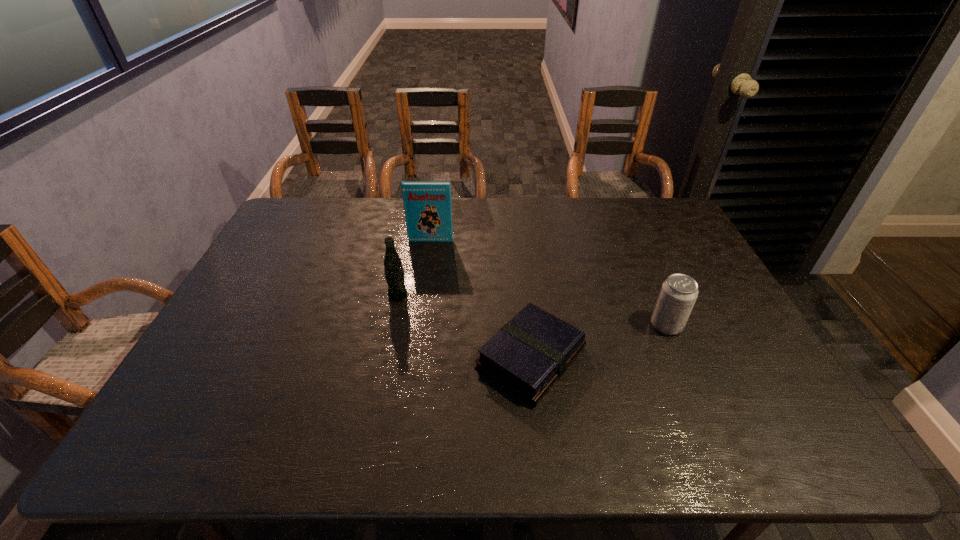
This screenshot has width=960, height=540. Identify the location of the taller book. (427, 204).

Locate an element on the screen. the farthest object is located at coordinates (427, 204).

This screenshot has width=960, height=540. Identify the location of beer bottle. (393, 270).

Locate an element on the screen. The width and height of the screenshot is (960, 540). soda can is located at coordinates (678, 294).

The height and width of the screenshot is (540, 960). Identify the location of the third tallest object. (678, 294).

The image size is (960, 540). What are the coordinates of `the shortest object` in the screenshot? It's located at (527, 356).

Where is `the shorter book`? the shorter book is located at coordinates (527, 356).

Where is `vacant space located on the front cover of the left book`? vacant space located on the front cover of the left book is located at coordinates (420, 320).

Find the location of `blank area located on the right of the second farthest object`. blank area located on the right of the second farthest object is located at coordinates (483, 295).

Locate an element on the screen. This screenshot has height=540, width=960. free space located 0.330m on the front of the soda can is located at coordinates (724, 457).